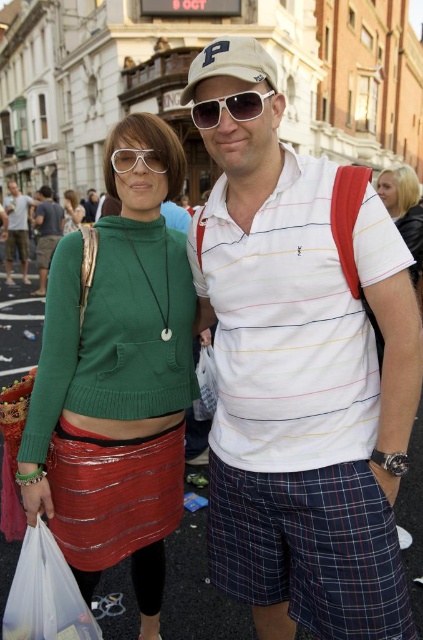
Does white fabric baseball cap at upper center appear on the right side of matte green sweater at center?

Yes, white fabric baseball cap at upper center is to the right of matte green sweater at center.

Which of these two, white fabric baseball cap at upper center or matte green sweater at center, stands shorter?

Standing shorter between the two is matte green sweater at center.

Image resolution: width=423 pixels, height=640 pixels. Describe the element at coordinates (230, 64) in the screenshot. I see `white fabric baseball cap at upper center` at that location.

Where is `white fabric baseball cap at upper center`? The height and width of the screenshot is (640, 423). white fabric baseball cap at upper center is located at coordinates (230, 64).

Can you confirm if plaid fabric kilt at lower right is taller than white plastic sunglasses at center?

Indeed, plaid fabric kilt at lower right has a greater height compared to white plastic sunglasses at center.

Is plaid fabric kilt at lower right further to the viewer compared to white plastic sunglasses at center?

That is False.

Is point (371, 577) positioned before point (206, 122)?

That is True.

Locate an element on the screen. This screenshot has width=423, height=640. plaid fabric kilt at lower right is located at coordinates (310, 548).

Is white plastic bag at lower left behind clear plastic goggles at center?

No.

Who is more forward, [5,627] or [162,170]?

Positioned in front is point [5,627].

At what (x,y) coordinates should I click in order to perform the action: click on white plastic bag at lower left. Please return your answer as a coordinate pair (x, y). This screenshot has height=640, width=423. Looking at the image, I should click on (46, 595).